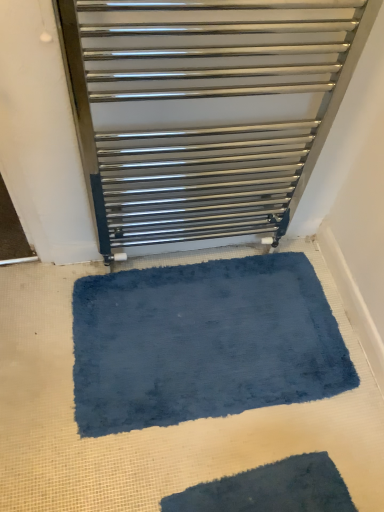
Locate an element on the screen. This screenshot has height=512, width=384. blue plush bath mat at center, arranged as the 2th bath mat when viewed from the front is located at coordinates (203, 342).

This screenshot has height=512, width=384. What do you see at coordinates (203, 342) in the screenshot?
I see `blue plush bath mat at center, positioned as the second bath mat in bottom-to-top order` at bounding box center [203, 342].

Describe the element at coordinates (204, 110) in the screenshot. I see `satin silver towel rail at upper center` at that location.

The image size is (384, 512). I want to click on dark blue shaggy bath mat at lower center, which appears as the second bath mat when viewed from the top, so click(270, 489).

Looking at this image, is satin silver towel rail at upper center turned away from blue plush bath mat at center, positioned as the second bath mat in bottom-to-top order?

satin silver towel rail at upper center does not have its back to blue plush bath mat at center, positioned as the second bath mat in bottom-to-top order.

Between satin silver towel rail at upper center and blue plush bath mat at center, which appears as the first bath mat when viewed from the top, which one has smaller width?

satin silver towel rail at upper center is thinner.

From a real-world perspective, is satin silver towel rail at upper center positioned above or below blue plush bath mat at center, the 1th bath mat positioned from the back?

satin silver towel rail at upper center is above blue plush bath mat at center, the 1th bath mat positioned from the back.

From the picture: From the image's perspective, which is above, satin silver towel rail at upper center or blue plush bath mat at center, arranged as the 2th bath mat when viewed from the front?

satin silver towel rail at upper center, from the image's perspective.

At what (x,y) coordinates should I click in order to perform the action: click on furniture on the left of dark blue shaggy bath mat at lower center, marked as the first bath mat in a bottom-to-top arrangement. Please return your answer as a coordinate pair (x, y). The image size is (384, 512). Looking at the image, I should click on (204, 110).

Considering the sizes of objects satin silver towel rail at upper center and dark blue shaggy bath mat at lower center, which appears as the second bath mat when viewed from the top, in the image provided, who is wider, satin silver towel rail at upper center or dark blue shaggy bath mat at lower center, which appears as the second bath mat when viewed from the top,?

Wider between the two is dark blue shaggy bath mat at lower center, which appears as the second bath mat when viewed from the top.

From a real-world perspective, between satin silver towel rail at upper center and dark blue shaggy bath mat at lower center, positioned as the second bath mat in back-to-front order, who is vertically higher?

satin silver towel rail at upper center, from a real-world perspective.

In the scene shown: What's the angular difference between blue plush bath mat at center, arranged as the 2th bath mat when viewed from the front, and satin silver towel rail at upper center's facing directions?

180 degrees separate the facing orientations of blue plush bath mat at center, arranged as the 2th bath mat when viewed from the front, and satin silver towel rail at upper center.

From the picture: Is satin silver towel rail at upper center at the back of blue plush bath mat at center, which appears as the first bath mat when viewed from the top?

No.

Is point (132, 396) positioned before point (300, 142)?

That is False.

Considering the sizes of blue plush bath mat at center, which appears as the first bath mat when viewed from the top, and satin silver towel rail at upper center in the image, is blue plush bath mat at center, which appears as the first bath mat when viewed from the top, taller or shorter than satin silver towel rail at upper center?

blue plush bath mat at center, which appears as the first bath mat when viewed from the top, is shorter than satin silver towel rail at upper center.

Is dark blue shaggy bath mat at lower center, marked as the first bath mat in a bottom-to-top arrangement, positioned in front of satin silver towel rail at upper center?

No, the depth of dark blue shaggy bath mat at lower center, marked as the first bath mat in a bottom-to-top arrangement, is greater than that of satin silver towel rail at upper center.

Which of these two, dark blue shaggy bath mat at lower center, marked as the first bath mat in a bottom-to-top arrangement, or satin silver towel rail at upper center, is smaller?

Smaller between the two is dark blue shaggy bath mat at lower center, marked as the first bath mat in a bottom-to-top arrangement.

The height and width of the screenshot is (512, 384). I want to click on the 2nd bath mat counting from the right of the satin silver towel rail at upper center, so (270, 489).

Is dark blue shaggy bath mat at lower center, which appears as the second bath mat when viewed from the top, far away from satin silver towel rail at upper center?

No, dark blue shaggy bath mat at lower center, which appears as the second bath mat when viewed from the top, is in close proximity to satin silver towel rail at upper center.

From a real-world perspective, which is physically below, dark blue shaggy bath mat at lower center, positioned as the second bath mat in back-to-front order, or blue plush bath mat at center, positioned as the second bath mat in bottom-to-top order?

In real-world perspective, dark blue shaggy bath mat at lower center, positioned as the second bath mat in back-to-front order, is lower.

Considering the relative positions of dark blue shaggy bath mat at lower center, positioned as the second bath mat in back-to-front order, and blue plush bath mat at center, positioned as the second bath mat in bottom-to-top order, in the image provided, is dark blue shaggy bath mat at lower center, positioned as the second bath mat in back-to-front order, in front of blue plush bath mat at center, positioned as the second bath mat in bottom-to-top order,?

Yes.

Are dark blue shaggy bath mat at lower center, which appears as the second bath mat when viewed from the top, and blue plush bath mat at center, arranged as the 2th bath mat when viewed from the front, making contact?

No, dark blue shaggy bath mat at lower center, which appears as the second bath mat when viewed from the top, is not with blue plush bath mat at center, arranged as the 2th bath mat when viewed from the front.

Between blue plush bath mat at center, which appears as the first bath mat when viewed from the top, and dark blue shaggy bath mat at lower center, marked as the first bath mat in a bottom-to-top arrangement, which one is positioned behind?

blue plush bath mat at center, which appears as the first bath mat when viewed from the top, is behind.

Which of these two, blue plush bath mat at center, arranged as the 2th bath mat when viewed from the front, or dark blue shaggy bath mat at lower center, marked as the first bath mat in a bottom-to-top arrangement, stands taller?

Standing taller between the two is blue plush bath mat at center, arranged as the 2th bath mat when viewed from the front.

What's the angular difference between blue plush bath mat at center, the 1th bath mat positioned from the back, and dark blue shaggy bath mat at lower center, marked as the first bath mat in a bottom-to-top arrangement,'s facing directions?

The angular difference between blue plush bath mat at center, the 1th bath mat positioned from the back, and dark blue shaggy bath mat at lower center, marked as the first bath mat in a bottom-to-top arrangement, is 7.64 degrees.

Which bath mat is the 2nd one when counting from the back of the satin silver towel rail at upper center? Please provide its 2D coordinates.

[(203, 342)]

Image resolution: width=384 pixels, height=512 pixels. I want to click on furniture located above the dark blue shaggy bath mat at lower center, which appears as the second bath mat when viewed from the top (from a real-world perspective), so click(x=204, y=110).

From the picture: Looking at the image, which one is located further to dark blue shaggy bath mat at lower center, which appears as the second bath mat when viewed from the top, satin silver towel rail at upper center or blue plush bath mat at center, arranged as the 2th bath mat when viewed from the front?

Based on the image, satin silver towel rail at upper center appears to be further to dark blue shaggy bath mat at lower center, which appears as the second bath mat when viewed from the top.

From the image, which object appears to be farther from satin silver towel rail at upper center, dark blue shaggy bath mat at lower center, positioned as the second bath mat in back-to-front order, or blue plush bath mat at center, which appears as the first bath mat when viewed from the top?

Among the two, dark blue shaggy bath mat at lower center, positioned as the second bath mat in back-to-front order, is located further to satin silver towel rail at upper center.

Which object lies further to the anchor point blue plush bath mat at center, the 1th bath mat positioned from the back, dark blue shaggy bath mat at lower center, which ranks as the first bath mat in front-to-back order, or satin silver towel rail at upper center?

satin silver towel rail at upper center lies further to blue plush bath mat at center, the 1th bath mat positioned from the back, than the other object.

From the image, which object appears to be nearer to satin silver towel rail at upper center, blue plush bath mat at center, the 1th bath mat positioned from the back, or dark blue shaggy bath mat at lower center, positioned as the second bath mat in back-to-front order?

blue plush bath mat at center, the 1th bath mat positioned from the back, lies closer to satin silver towel rail at upper center than the other object.

Looking at the image, which one is located closer to blue plush bath mat at center, the 1th bath mat positioned from the back, satin silver towel rail at upper center or dark blue shaggy bath mat at lower center, which ranks as the first bath mat in front-to-back order?

dark blue shaggy bath mat at lower center, which ranks as the first bath mat in front-to-back order, is positioned closer to the anchor blue plush bath mat at center, the 1th bath mat positioned from the back.

Considering their positions, is blue plush bath mat at center, the 1th bath mat positioned from the back, positioned further to dark blue shaggy bath mat at lower center, which ranks as the first bath mat in front-to-back order, than satin silver towel rail at upper center?

Based on the image, satin silver towel rail at upper center appears to be further to dark blue shaggy bath mat at lower center, which ranks as the first bath mat in front-to-back order.

Identify the location of bath mat between satin silver towel rail at upper center and dark blue shaggy bath mat at lower center, which appears as the second bath mat when viewed from the top, in the vertical direction. Image resolution: width=384 pixels, height=512 pixels. (203, 342).